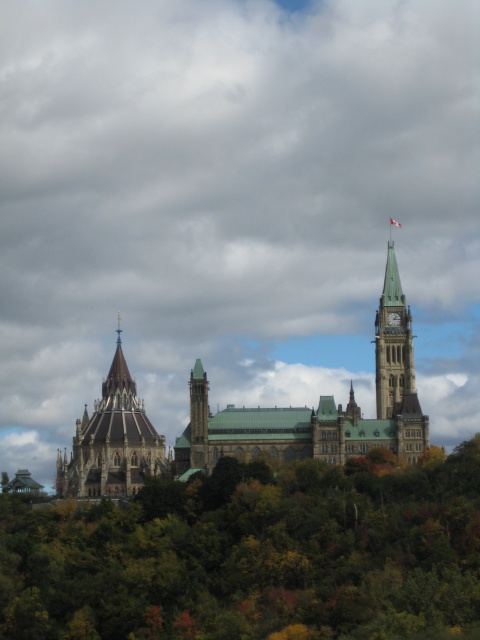
Question: Is dark gray stone tower at left further to camera compared to green stone clock tower at upper right?

Choices:
 (A) no
 (B) yes

Answer: (B)

Question: Which object is the farthest from the green stone clock tower at upper right?

Choices:
 (A) dark gray stone tower at left
 (B) green leafy trees at center
 (C) brown stone church at center

Answer: (A)

Question: From the image, what is the correct spatial relationship of dark gray stone tower at left in relation to green stone clock tower at upper right?

Choices:
 (A) right
 (B) left

Answer: (B)

Question: Does dark gray stone tower at left have a greater width compared to green stone clock tower at upper right?

Choices:
 (A) yes
 (B) no

Answer: (A)

Question: Which object is positioned closest to the green stone clock tower at upper right?

Choices:
 (A) brown stone church at center
 (B) green leafy trees at center
 (C) dark gray stone tower at left

Answer: (A)

Question: Among these objects, which one is nearest to the camera?

Choices:
 (A) brown stone church at center
 (B) green stone clock tower at upper right
 (C) green leafy trees at center

Answer: (C)